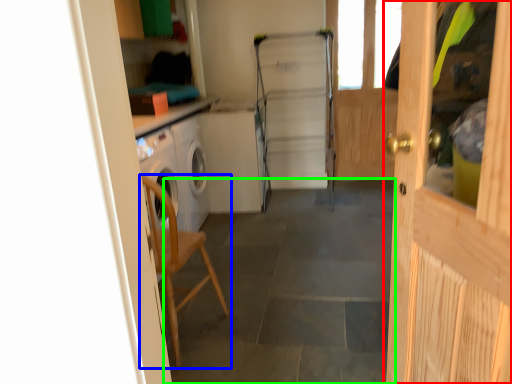
Question: Which is nearer to the door (highlighted by a red box)? chair (highlighted by a blue box) or concrete (highlighted by a green box).

Choices:
 (A) chair
 (B) concrete

Answer: (B)